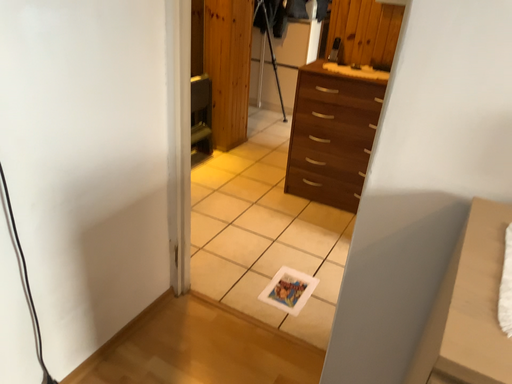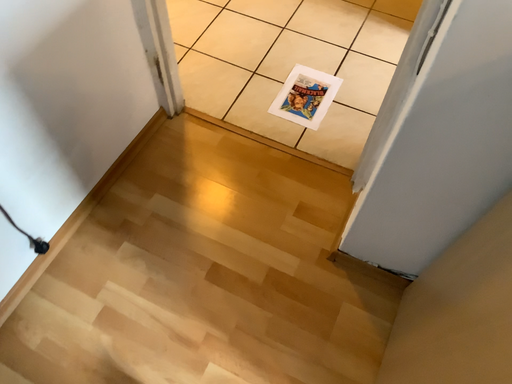
Question: Which way did the camera rotate in the video?

Choices:
 (A) rotated upward
 (B) rotated downward

Answer: (B)